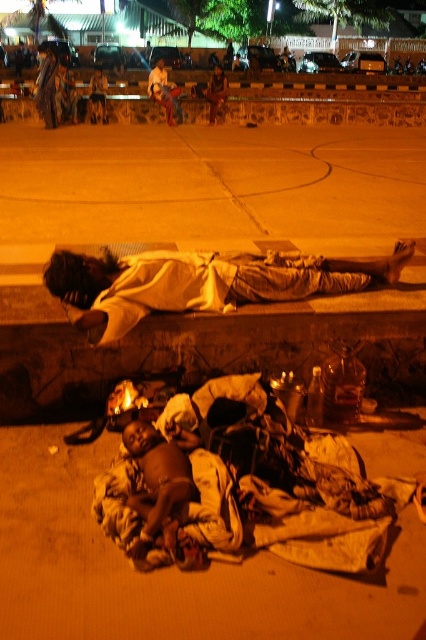
You are a delivery person who needs to place a small package on the ground near the brown fabric blanket at lower center. Which coordinate should you use to ensure the package is placed correctly?

You should place the package near the brown fabric blanket at lower center at point coordinates (169, 568).

You are a social worker assessing the situation of two people in need. You notice the brown fabric blanket at lower center and the white clothed person at center. Which object has a smaller width?

The brown fabric blanket at lower center has a lesser width compared to the white clothed person at center, so the brown fabric blanket at lower center is smaller in width.

You are a social worker who needs to assess the safety of the white clothed person at center and the dark skin baby at lower center. Considering the distance between them, can you determine if the baby is within a safe proximity to the person for immediate care?

The white clothed person at center and the dark skin baby at lower center are 98.25 centimeters apart from each other. Based on safety guidelines, a safe proximity for immediate care typically requires the caregiver to be within arm reach, which is generally around 50 centimeters or less. Since the distance exceeds this, the baby may not be within a safe proximity for immediate care.